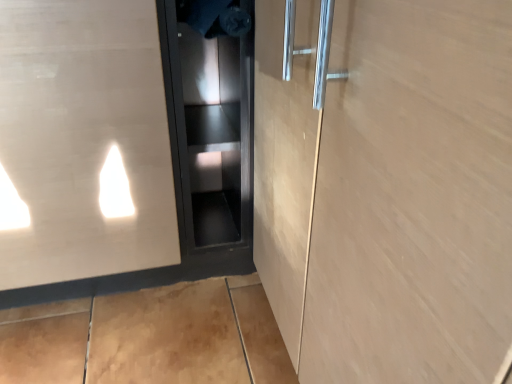
What do you see at coordinates (210, 138) in the screenshot? I see `black matte cabinet at center, placed as the 2th elevator door when sorted from left to right` at bounding box center [210, 138].

The image size is (512, 384). Identify the location of black matte cabinet at center, placed as the 2th elevator door when sorted from left to right. (210, 138).

How much space does satin silver elevator door at left, the second elevator door positioned from the right, occupy horizontally?

The width of satin silver elevator door at left, the second elevator door positioned from the right, is 25.65 inches.

Identify the location of satin silver elevator door at left, the second elevator door positioned from the right. (83, 142).

What do you see at coordinates (83, 142) in the screenshot? The width and height of the screenshot is (512, 384). I see `satin silver elevator door at left, the second elevator door positioned from the right` at bounding box center [83, 142].

Where is `black matte cabinet at center, the first elevator door in the right-to-left sequence`? black matte cabinet at center, the first elevator door in the right-to-left sequence is located at coordinates (210, 138).

Considering the relative positions of satin silver elevator door at left, the 1th elevator door when ordered from left to right, and black matte cabinet at center, the first elevator door in the right-to-left sequence, in the image provided, is satin silver elevator door at left, the 1th elevator door when ordered from left to right, to the left or to the right of black matte cabinet at center, the first elevator door in the right-to-left sequence,?

In the image, satin silver elevator door at left, the 1th elevator door when ordered from left to right, appears on the left side of black matte cabinet at center, the first elevator door in the right-to-left sequence.

Considering their positions, is satin silver elevator door at left, the second elevator door positioned from the right, located in front of or behind black matte cabinet at center, the first elevator door in the right-to-left sequence?

satin silver elevator door at left, the second elevator door positioned from the right, is in front of black matte cabinet at center, the first elevator door in the right-to-left sequence.

Between point (55, 205) and point (185, 221), which one is positioned behind?

Positioned behind is point (185, 221).

From the image's perspective, is satin silver elevator door at left, the second elevator door positioned from the right, above or below black matte cabinet at center, placed as the 2th elevator door when sorted from left to right?

Clearly, from the image's perspective, satin silver elevator door at left, the second elevator door positioned from the right, is above black matte cabinet at center, placed as the 2th elevator door when sorted from left to right.

From a real-world perspective, which object stands above the other?

In real-world perspective, satin silver elevator door at left, the 1th elevator door when ordered from left to right, is above.

Considering the sizes of objects satin silver elevator door at left, the second elevator door positioned from the right, and black matte cabinet at center, placed as the 2th elevator door when sorted from left to right, in the image provided, who is wider, satin silver elevator door at left, the second elevator door positioned from the right, or black matte cabinet at center, placed as the 2th elevator door when sorted from left to right,?

satin silver elevator door at left, the second elevator door positioned from the right.

Between satin silver elevator door at left, the 1th elevator door when ordered from left to right, and black matte cabinet at center, placed as the 2th elevator door when sorted from left to right, which one has less height?

Standing shorter between the two is black matte cabinet at center, placed as the 2th elevator door when sorted from left to right.

Does satin silver elevator door at left, the second elevator door positioned from the right, have a smaller size compared to black matte cabinet at center, the first elevator door in the right-to-left sequence?

No, satin silver elevator door at left, the second elevator door positioned from the right, is not smaller than black matte cabinet at center, the first elevator door in the right-to-left sequence.

Can black matte cabinet at center, placed as the 2th elevator door when sorted from left to right, be found inside satin silver elevator door at left, the 1th elevator door when ordered from left to right?

Actually, black matte cabinet at center, placed as the 2th elevator door when sorted from left to right, is outside satin silver elevator door at left, the 1th elevator door when ordered from left to right.

Is satin silver elevator door at left, the second elevator door positioned from the right, not near black matte cabinet at center, placed as the 2th elevator door when sorted from left to right?

No, satin silver elevator door at left, the second elevator door positioned from the right, is not far from black matte cabinet at center, placed as the 2th elevator door when sorted from left to right.

Is satin silver elevator door at left, the second elevator door positioned from the right, positioned with its back to black matte cabinet at center, placed as the 2th elevator door when sorted from left to right?

No, satin silver elevator door at left, the second elevator door positioned from the right,'s orientation is not away from black matte cabinet at center, placed as the 2th elevator door when sorted from left to right.

Can you tell me how much satin silver elevator door at left, the 1th elevator door when ordered from left to right, and black matte cabinet at center, placed as the 2th elevator door when sorted from left to right, differ in facing direction?

7.2e-05 degrees separate the facing orientations of satin silver elevator door at left, the 1th elevator door when ordered from left to right, and black matte cabinet at center, placed as the 2th elevator door when sorted from left to right.

Locate an element on the screen. elevator door on the left of black matte cabinet at center, the first elevator door in the right-to-left sequence is located at coordinates (83, 142).

Is black matte cabinet at center, placed as the 2th elevator door when sorted from left to right, to the right of satin silver elevator door at left, the second elevator door positioned from the right, from the viewer's perspective?

Yes, black matte cabinet at center, placed as the 2th elevator door when sorted from left to right, is to the right of satin silver elevator door at left, the second elevator door positioned from the right.

In the image, is black matte cabinet at center, the first elevator door in the right-to-left sequence, positioned in front of or behind satin silver elevator door at left, the second elevator door positioned from the right?

black matte cabinet at center, the first elevator door in the right-to-left sequence, is positioned farther from the viewer than satin silver elevator door at left, the second elevator door positioned from the right.

Which is less distant, (213,226) or (82,136)?

Point (213,226) appears to be farther away from the viewer than point (82,136).

From the image's perspective, does black matte cabinet at center, placed as the 2th elevator door when sorted from left to right, appear lower than satin silver elevator door at left, the second elevator door positioned from the right?

Indeed, from the image's perspective, black matte cabinet at center, placed as the 2th elevator door when sorted from left to right, is shown beneath satin silver elevator door at left, the second elevator door positioned from the right.

From the picture: From a real-world perspective, is black matte cabinet at center, placed as the 2th elevator door when sorted from left to right, positioned under satin silver elevator door at left, the second elevator door positioned from the right, based on gravity?

Correct, in the physical world, black matte cabinet at center, placed as the 2th elevator door when sorted from left to right, is lower than satin silver elevator door at left, the second elevator door positioned from the right.

Considering the relative sizes of black matte cabinet at center, the first elevator door in the right-to-left sequence, and satin silver elevator door at left, the second elevator door positioned from the right, in the image provided, is black matte cabinet at center, the first elevator door in the right-to-left sequence, wider than satin silver elevator door at left, the second elevator door positioned from the right,?

No.

Considering the relative sizes of black matte cabinet at center, the first elevator door in the right-to-left sequence, and satin silver elevator door at left, the second elevator door positioned from the right, in the image provided, is black matte cabinet at center, the first elevator door in the right-to-left sequence, shorter than satin silver elevator door at left, the second elevator door positioned from the right,?

Correct, black matte cabinet at center, the first elevator door in the right-to-left sequence, is not as tall as satin silver elevator door at left, the second elevator door positioned from the right.

Consider the image. Is black matte cabinet at center, the first elevator door in the right-to-left sequence, smaller than satin silver elevator door at left, the 1th elevator door when ordered from left to right?

Indeed, black matte cabinet at center, the first elevator door in the right-to-left sequence, has a smaller size compared to satin silver elevator door at left, the 1th elevator door when ordered from left to right.

Is satin silver elevator door at left, the second elevator door positioned from the right, a part of black matte cabinet at center, placed as the 2th elevator door when sorted from left to right?

That's incorrect, satin silver elevator door at left, the second elevator door positioned from the right, is not inside black matte cabinet at center, placed as the 2th elevator door when sorted from left to right.

In the scene shown: Is black matte cabinet at center, placed as the 2th elevator door when sorted from left to right, beside satin silver elevator door at left, the 1th elevator door when ordered from left to right?

No, black matte cabinet at center, placed as the 2th elevator door when sorted from left to right, is not touching satin silver elevator door at left, the 1th elevator door when ordered from left to right.

Does black matte cabinet at center, placed as the 2th elevator door when sorted from left to right, turn towards satin silver elevator door at left, the second elevator door positioned from the right?

No, black matte cabinet at center, placed as the 2th elevator door when sorted from left to right, is not aimed at satin silver elevator door at left, the second elevator door positioned from the right.

How many degrees apart are the facing directions of black matte cabinet at center, placed as the 2th elevator door when sorted from left to right, and satin silver elevator door at left, the 1th elevator door when ordered from left to right?

There is a 7.2e-05-degree angle between the facing directions of black matte cabinet at center, placed as the 2th elevator door when sorted from left to right, and satin silver elevator door at left, the 1th elevator door when ordered from left to right.

At what (x,y) coordinates should I click in order to perform the action: click on elevator door that appears in front of the black matte cabinet at center, the first elevator door in the right-to-left sequence. Please return your answer as a coordinate pair (x, y). This screenshot has height=384, width=512. Looking at the image, I should click on (83, 142).

You are a GUI agent. You are given a task and a screenshot of the screen. Output one action in this format:
    pyautogui.click(x=<x>, y=<y>)
    Task: Click on the elevator door in front of the black matte cabinet at center, placed as the 2th elevator door when sorted from left to right
    Image resolution: width=512 pixels, height=384 pixels.
    Given the screenshot: What is the action you would take?
    pyautogui.click(x=83, y=142)

Locate an element on the screen. elevator door behind the satin silver elevator door at left, the second elevator door positioned from the right is located at coordinates (210, 138).